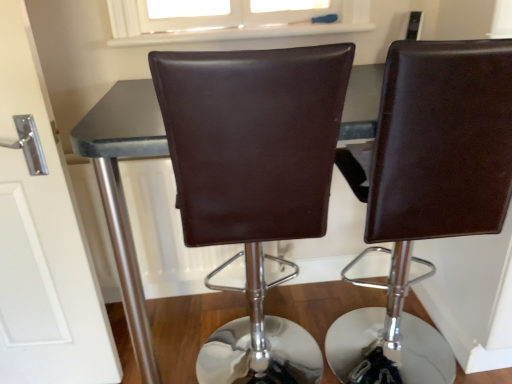
Question: In which direction should I rotate to look at brown leather chair at center, arranged as the second chair when viewed from the left?

Choices:
 (A) right
 (B) left

Answer: (A)

Question: From a real-world perspective, is brown leather chair at center, arranged as the second chair when viewed from the left, below matte black table at center?

Choices:
 (A) yes
 (B) no

Answer: (B)

Question: From the image's perspective, is brown leather chair at center, which is the 1th chair in right-to-left order, over matte black table at center?

Choices:
 (A) yes
 (B) no

Answer: (A)

Question: Can you confirm if brown leather chair at center, arranged as the second chair when viewed from the left, is positioned to the left of matte black table at center?

Choices:
 (A) yes
 (B) no

Answer: (B)

Question: Is brown leather chair at center, which is the 1th chair in right-to-left order, at the right side of matte black table at center?

Choices:
 (A) no
 (B) yes

Answer: (B)

Question: From the image's perspective, is brown leather chair at center, arranged as the second chair when viewed from the left, beneath matte black table at center?

Choices:
 (A) yes
 (B) no

Answer: (B)

Question: Is brown leather chair at center, which is the 1th chair in right-to-left order, oriented away from matte black table at center?

Choices:
 (A) yes
 (B) no

Answer: (A)

Question: Is brown leather chair at center, positioned as the first chair in left-to-right order, smaller than matte black table at center?

Choices:
 (A) yes
 (B) no

Answer: (A)

Question: Does brown leather chair at center, the second chair in the right-to-left sequence, turn towards matte black table at center?

Choices:
 (A) yes
 (B) no

Answer: (A)

Question: From a real-world perspective, does brown leather chair at center, positioned as the first chair in left-to-right order, stand above matte black table at center?

Choices:
 (A) yes
 (B) no

Answer: (A)

Question: Is brown leather chair at center, positioned as the first chair in left-to-right order, positioned beyond the bounds of matte black table at center?

Choices:
 (A) no
 (B) yes

Answer: (A)

Question: Can you confirm if brown leather chair at center, positioned as the first chair in left-to-right order, is wider than matte black table at center?

Choices:
 (A) no
 (B) yes

Answer: (A)

Question: Is matte black table at center inside white glossy door at left?

Choices:
 (A) no
 (B) yes

Answer: (A)